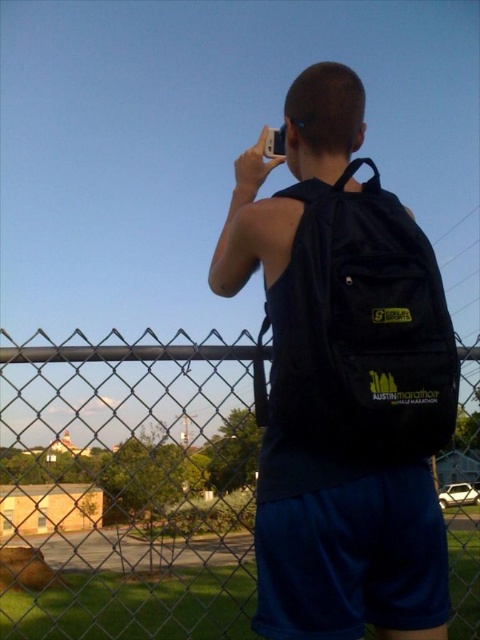
You are a photographer trying to capture the best shot of the black matte backpack at center. The camera has a focus point system that allows you to select a focus point at specific coordinates. What coordinates should you use to ensure the backpack is in focus?

The black matte backpack at center is positioned at coordinates point (344, 381), so you should set the focus point to those coordinates to ensure the backpack is in focus.